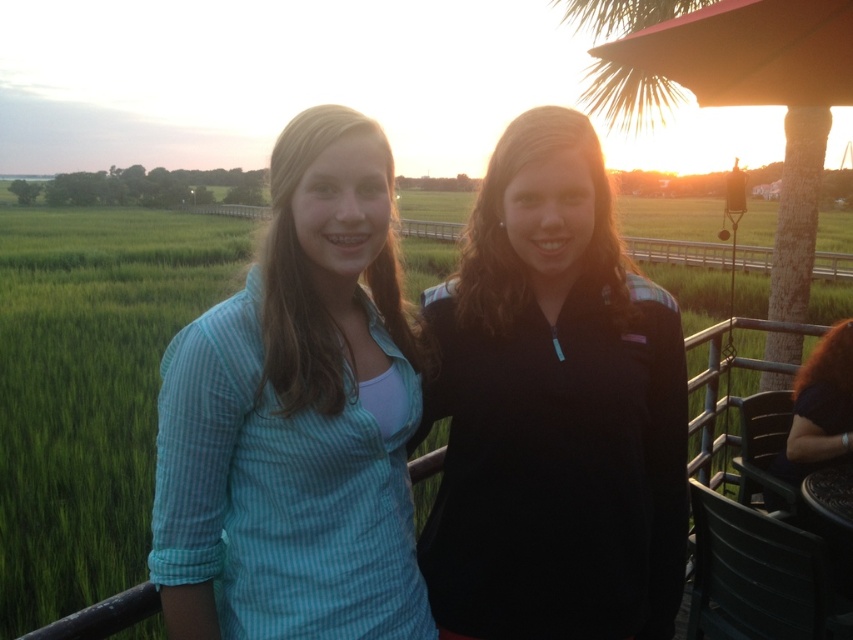
Question: Among these points, which one is nearest to the camera?

Choices:
 (A) (605, 243)
 (B) (283, 458)
 (C) (15, 342)

Answer: (B)

Question: Considering the relative positions of black fleece jacket at center and green grass at center in the image provided, where is black fleece jacket at center located with respect to green grass at center?

Choices:
 (A) left
 (B) right

Answer: (B)

Question: Is black fleece jacket at center smaller than teal striped shirt at center?

Choices:
 (A) no
 (B) yes

Answer: (B)

Question: Is black fleece jacket at center wider than teal striped shirt at center?

Choices:
 (A) yes
 (B) no

Answer: (A)

Question: Which object is the farthest from the black fleece jacket at center?

Choices:
 (A) green grass at center
 (B) teal striped shirt at center

Answer: (A)

Question: Which object is the closest to the green grass at center?

Choices:
 (A) black fleece jacket at center
 (B) teal striped shirt at center

Answer: (B)